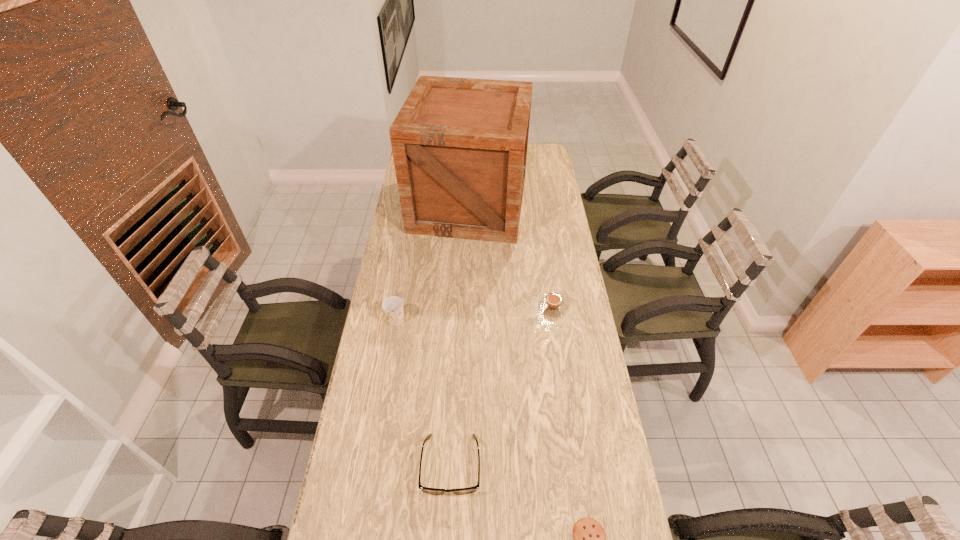
Where is `box`? box is located at coordinates (459, 145).

Identify the location of the farthest object. This screenshot has height=540, width=960. (459, 145).

At what (x,y) coordinates should I click in order to perform the action: click on the second tallest object. Please return your answer as a coordinate pair (x, y). The height and width of the screenshot is (540, 960). Looking at the image, I should click on (393, 306).

The width and height of the screenshot is (960, 540). What are the coordinates of `spectacles` in the screenshot? It's located at (435, 491).

Image resolution: width=960 pixels, height=540 pixels. I want to click on cappuccino, so click(553, 304).

At what (x,y) coordinates should I click in order to perform the action: click on free space located on the front of the tallest object. Please return your answer as a coordinate pair (x, y). Looking at the image, I should click on (466, 313).

In order to click on vacant space located 0.350m on the back of the Dixie cup in this screenshot , I will do `click(408, 248)`.

You are a GUI agent. You are given a task and a screenshot of the screen. Output one action in this format:
    pyautogui.click(x=<x>, y=<y>)
    Task: Click on the free space located 0.330m on the front of the cappuccino
    Image resolution: width=960 pixels, height=540 pixels.
    Given the screenshot: What is the action you would take?
    pyautogui.click(x=567, y=402)

This screenshot has height=540, width=960. What are the coordinates of `box positioned at the left edge` in the screenshot? It's located at (459, 145).

The height and width of the screenshot is (540, 960). In order to click on Dixie cup at the left edge in this screenshot , I will do `click(393, 306)`.